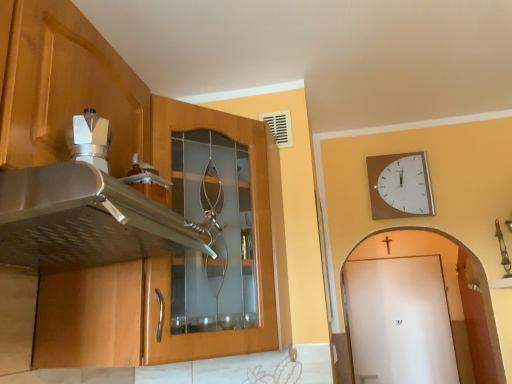
Question: Is wooden cabinet at left inside the boundaries of white matte door at right, or outside?

Choices:
 (A) outside
 (B) inside

Answer: (A)

Question: Is wooden cabinet at left in front of or behind white matte door at right in the image?

Choices:
 (A) behind
 (B) front

Answer: (B)

Question: Estimate the real-world distances between objects in this image. Which object is farther from the wooden clock at upper right?

Choices:
 (A) wooden cabinet at left
 (B) white matte door at right

Answer: (B)

Question: Estimate the real-world distances between objects in this image. Which object is farther from the wooden cabinet at left?

Choices:
 (A) white matte door at right
 (B) wooden clock at upper right

Answer: (A)